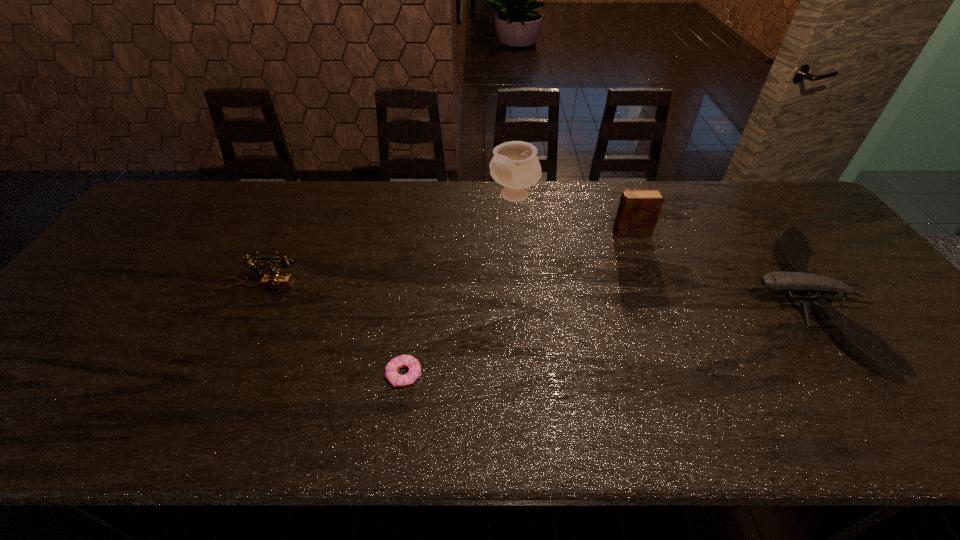
What are the coordinates of `free space that is in between the leftmost object and the rightmost object` in the screenshot? It's located at (532, 293).

The height and width of the screenshot is (540, 960). What are the coordinates of `vacant space that is in between the fourth nearest object and the doughnut` in the screenshot? It's located at (517, 303).

This screenshot has height=540, width=960. Identify the location of vacant space that is in between the third object from right to left and the second object from right to left. (572, 214).

At what (x,y) coordinates should I click in order to perform the action: click on free space between the second object from left to right and the telephone. Please return your answer as a coordinate pair (x, y). The width and height of the screenshot is (960, 540). Looking at the image, I should click on (331, 330).

This screenshot has height=540, width=960. Identify the location of object that is the closest to the rightmost object. (639, 208).

Identify the location of the third closest object to the diary. This screenshot has width=960, height=540. (397, 380).

Where is `free point that satisfies the following two spatial constraints: 1. at the head of the drone; 2. on the front side of the second object from left to right`? The width and height of the screenshot is (960, 540). free point that satisfies the following two spatial constraints: 1. at the head of the drone; 2. on the front side of the second object from left to right is located at coordinates click(x=856, y=375).

Image resolution: width=960 pixels, height=540 pixels. In order to click on free location that satisfies the following two spatial constraints: 1. on the spine side of the fourth object from left to right; 2. on the front-facing side of the leftmost object in this screenshot , I will do `click(651, 285)`.